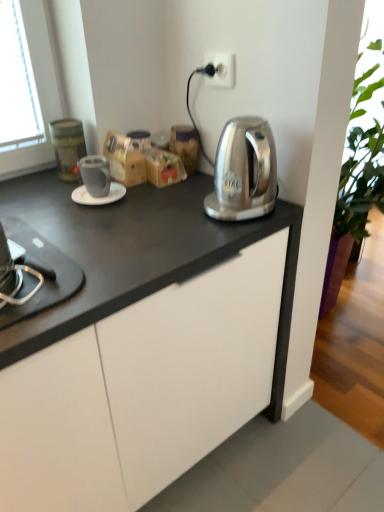
Locate an element on the screen. This screenshot has height=512, width=384. white plastic electric outlet at upper center is located at coordinates (221, 69).

The image size is (384, 512). I want to click on brown paper bag at center, the second cabinetry when ordered from left to right, so click(163, 167).

Measure the distance between point (50,291) and camera.

Point (50,291) is 33.23 inches from camera.

From the picture: What is the approximate height of black glass stovetop at lower left?

16.04 centimeters.

Find the location of a particular element. The image size is (384, 512). brown cardboard box at center is located at coordinates (124, 160).

Is black glass stovetop at lower left wider or thinner than white plastic electric outlet at upper center?

In the image, black glass stovetop at lower left appears to be wider than white plastic electric outlet at upper center.

Can you tell me how much black glass stovetop at lower left and white plastic electric outlet at upper center differ in facing direction?

They differ by 87 degrees in their facing directions.

Which is in front, point (30, 275) or point (212, 58)?

Positioned in front is point (30, 275).

Do you think black glass stovetop at lower left is within white plastic electric outlet at upper center, or outside of it?

black glass stovetop at lower left is spatially situated outside white plastic electric outlet at upper center.

Does black glass stovetop at lower left have a lesser width compared to white matte cabinet at center, placed as the 2th cabinetry when sorted from top to bottom?

Yes, black glass stovetop at lower left is thinner than white matte cabinet at center, placed as the 2th cabinetry when sorted from top to bottom.

Between point (8, 314) and point (171, 340), which one is positioned in front?

The point (8, 314) is closer to the camera.

Is there a large distance between black glass stovetop at lower left and white matte cabinet at center, placed as the 2th cabinetry when sorted from top to bottom?

They are positioned close to each other.

Between black glass stovetop at lower left and white matte cabinet at center, the 1th cabinetry ordered from the bottom, which one is positioned in front?

white matte cabinet at center, the 1th cabinetry ordered from the bottom, is more forward.

Can you tell me how much white glossy saucer at center and satin silver kettle at center differ in facing direction?

There is a 11.3-degree angle between the facing directions of white glossy saucer at center and satin silver kettle at center.

From a real-world perspective, is white glossy saucer at center above or below satin silver kettle at center?

Clearly, from a real-world perspective, white glossy saucer at center is below satin silver kettle at center.

Is white glossy saucer at center far away from satin silver kettle at center?

They are positioned close to each other.

Would you say white glossy saucer at center is inside or outside satin silver kettle at center?

white glossy saucer at center is located beyond the bounds of satin silver kettle at center.

The image size is (384, 512). I want to click on electric outlet behind the white matte cabinet at center, acting as the 2th cabinetry starting from the back, so click(x=221, y=69).

Can you confirm if white plastic electric outlet at upper center is bigger than white matte cabinet at center, placed as the 2th cabinetry when sorted from top to bottom?

Actually, white plastic electric outlet at upper center might be smaller than white matte cabinet at center, placed as the 2th cabinetry when sorted from top to bottom.

Which is more to the left, white plastic electric outlet at upper center or white matte cabinet at center, placed as the 2th cabinetry when sorted from top to bottom?

white matte cabinet at center, placed as the 2th cabinetry when sorted from top to bottom, is more to the left.

Based on the photo, would you say satin silver kettle at center contains white plastic electric outlet at upper center?

No.

Is satin silver kettle at center beside white plastic electric outlet at upper center?

satin silver kettle at center and white plastic electric outlet at upper center are not in contact.

Considering the relative sizes of satin silver kettle at center and white plastic electric outlet at upper center in the image provided, is satin silver kettle at center shorter than white plastic electric outlet at upper center?

In fact, satin silver kettle at center may be taller than white plastic electric outlet at upper center.

From a real-world perspective, which is physically above, satin silver kettle at center or white plastic electric outlet at upper center?

From a 3D spatial view, white plastic electric outlet at upper center is above.

Is white matte cabinet at center, the first cabinetry positioned from the left, not near matte gray mug at center-left?

white matte cabinet at center, the first cabinetry positioned from the left, is near matte gray mug at center-left, not far away.

Looking at their sizes, would you say white matte cabinet at center, the first cabinetry positioned from the left, is wider or thinner than matte gray mug at center-left?

Considering their sizes, white matte cabinet at center, the first cabinetry positioned from the left, looks broader than matte gray mug at center-left.

Which point is more forward, (157, 439) or (98, 186)?

The point (157, 439) is in front.

From a real-world perspective, is brown paper bag at center, the second cabinetry when ordered from left to right, positioned above or below brown cardboard box at center?

In terms of real-world spatial position, brown paper bag at center, the second cabinetry when ordered from left to right, is below brown cardboard box at center.

Looking at the image, does brown paper bag at center, the first cabinetry positioned from the right, seem bigger or smaller compared to brown cardboard box at center?

Considering their sizes, brown paper bag at center, the first cabinetry positioned from the right, takes up less space than brown cardboard box at center.

Is brown paper bag at center, the second cabinetry when ordered from left to right, oriented towards brown cardboard box at center?

No, brown paper bag at center, the second cabinetry when ordered from left to right, does not turn towards brown cardboard box at center.

Is brown paper bag at center, the first cabinetry positioned from the right, with brown cardboard box at center?

Yes, brown paper bag at center, the first cabinetry positioned from the right, is touching brown cardboard box at center.

Image resolution: width=384 pixels, height=512 pixels. Identify the location of electric outlet lying behind the black glass stovetop at lower left. (221, 69).

The image size is (384, 512). Identify the location of home appliance on the left side of white matte cabinet at center, placed as the 2th cabinetry when sorted from top to bottom. (41, 272).

Looking at the image, which one is located closer to black glass stovetop at lower left, matte gray mug at center-left or white glossy saucer at center?

white glossy saucer at center is positioned closer to the anchor black glass stovetop at lower left.

Considering their positions, is white matte cabinet at center, placed as the 2th cabinetry when sorted from right to left, positioned closer to white plastic electric outlet at upper center than white glossy saucer at center?

white glossy saucer at center is closer to white plastic electric outlet at upper center.

Consider the image. Which object lies nearer to the anchor point black glass stovetop at lower left, white glossy saucer at center or satin silver kettle at center?

white glossy saucer at center.

From the image, which object appears to be farther from white matte cabinet at center, the first cabinetry positioned from the left, matte gray mug at center-left or white plastic electric outlet at upper center?

Based on the image, white plastic electric outlet at upper center appears to be further to white matte cabinet at center, the first cabinetry positioned from the left.

Based on their spatial positions, is white matte cabinet at center, acting as the 2th cabinetry starting from the back, or satin silver kettle at center closer to brown cardboard box at center?

satin silver kettle at center lies closer to brown cardboard box at center than the other object.

When comparing their distances from white plastic electric outlet at upper center, does satin silver kettle at center or matte gray mug at center-left seem further?

Based on the image, matte gray mug at center-left appears to be further to white plastic electric outlet at upper center.

Looking at the image, which one is located closer to white matte cabinet at center, placed as the 2th cabinetry when sorted from right to left, white glossy saucer at center or brown cardboard box at center?

The object closer to white matte cabinet at center, placed as the 2th cabinetry when sorted from right to left, is white glossy saucer at center.

Which object lies further to the anchor point satin silver kettle at center, black glass stovetop at lower left or matte gray mug at center-left?

black glass stovetop at lower left.

What are the coordinates of `mug located between black glass stovetop at lower left and satin silver kettle at center in the left-right direction` in the screenshot? It's located at (95, 175).

Where is `mug between white matte cabinet at center, which is the 1th cabinetry in front-to-back order, and brown cardboard box at center in the front-back direction`? mug between white matte cabinet at center, which is the 1th cabinetry in front-to-back order, and brown cardboard box at center in the front-back direction is located at coordinates [x=95, y=175].

I want to click on saucer between black glass stovetop at lower left and satin silver kettle at center in the horizontal direction, so click(x=100, y=197).

Find the location of a particular element. This screenshot has width=384, height=512. cardboard box situated between matte gray mug at center-left and white plastic electric outlet at upper center from left to right is located at coordinates (124, 160).